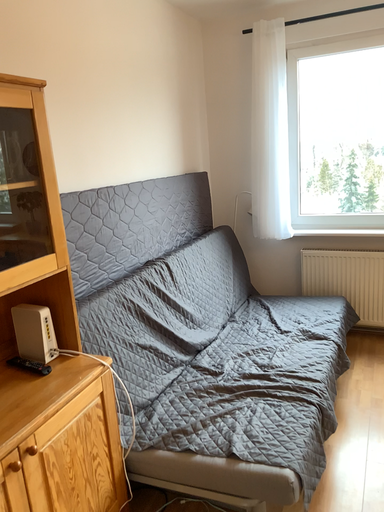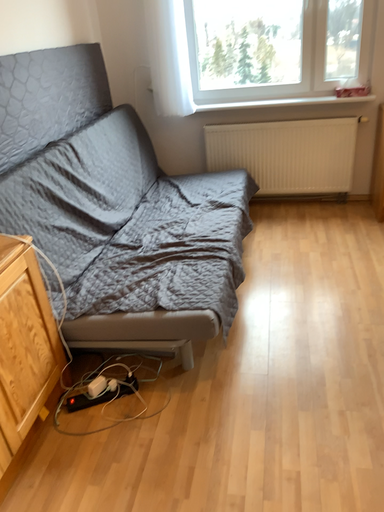
Question: How did the camera likely rotate when shooting the video?

Choices:
 (A) rotated downward
 (B) rotated upward

Answer: (A)